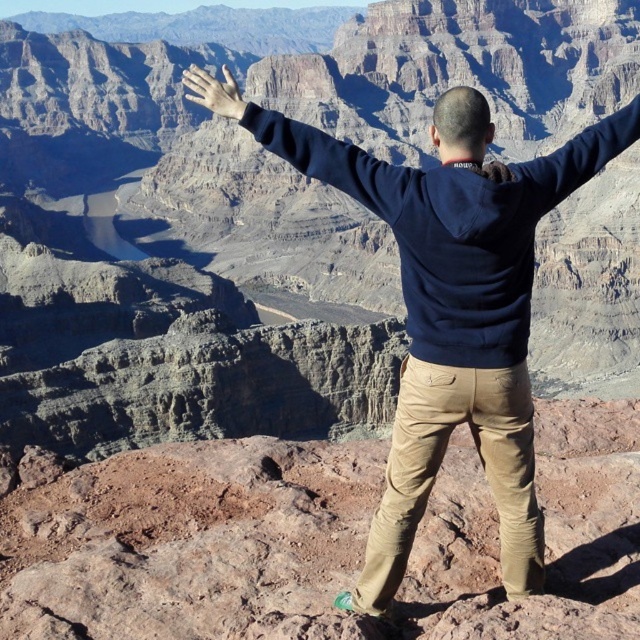
You are a photographer trying to capture the perfect shot of the person in the dark blue sweatshirt at center. Based on their position, where should you position your camera relative to the canyon edge to ensure they are centered in the frame?

The dark blue sweatshirt at center is located at point coordinates, so positioning the camera directly in line with those coordinates relative to the canyon edge would center them in the frame.

You are a photographer planning to capture the scene of the person at the canyon. You need to ensure that the dark blue sweatshirt at center and the matte skin hand at upper center are both visible in the frame. Based on their sizes, which object should you focus on to ensure both are in focus?

The dark blue sweatshirt at center has a smaller width than the matte skin hand at upper center. Therefore, focusing on the dark blue sweatshirt at center would ensure both objects are in focus since it is closer in size and can be captured within the same focal plane.

You are a photographer trying to capture the scene of the person at the canyon. You notice the dark blue sweatshirt at center and the matte skin hand at upper center. Which object is positioned lower in the image?

The dark blue sweatshirt at center is located below the matte skin hand at upper center, so the dark blue sweatshirt at center is positioned lower in the image.